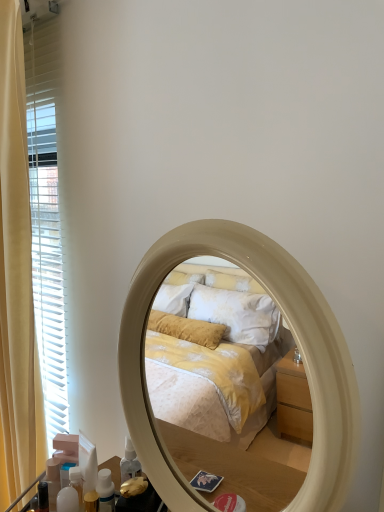
Question: Is beige glossy mirror at center wider than translucent plastic bottle at lower left, placed as the second toiletry when sorted from right to left?

Choices:
 (A) yes
 (B) no

Answer: (A)

Question: From the image's perspective, does beige glossy mirror at center appear lower than translucent plastic bottle at lower left, arranged as the 2th toiletry when viewed from the front?

Choices:
 (A) yes
 (B) no

Answer: (B)

Question: Is beige glossy mirror at center directly adjacent to translucent plastic bottle at lower left, the first toiletry positioned from the back?

Choices:
 (A) no
 (B) yes

Answer: (A)

Question: Considering the relative sizes of beige glossy mirror at center and translucent plastic bottle at lower left, placed as the second toiletry when sorted from right to left, in the image provided, is beige glossy mirror at center thinner than translucent plastic bottle at lower left, placed as the second toiletry when sorted from right to left,?

Choices:
 (A) yes
 (B) no

Answer: (B)

Question: Considering the relative positions of beige glossy mirror at center and translucent plastic bottle at lower left, placed as the second toiletry when sorted from right to left, in the image provided, is beige glossy mirror at center behind translucent plastic bottle at lower left, placed as the second toiletry when sorted from right to left,?

Choices:
 (A) yes
 (B) no

Answer: (B)

Question: Does beige glossy mirror at center have a lesser height compared to translucent plastic bottle at lower left, the first toiletry positioned from the back?

Choices:
 (A) yes
 (B) no

Answer: (B)

Question: Is beige glossy mirror at center surrounded by translucent plastic bottle at lower left, placed as the second toiletry when sorted from right to left?

Choices:
 (A) yes
 (B) no

Answer: (B)

Question: Does translucent plastic bottle at lower left, the first toiletry positioned from the back, appear on the left side of beige glossy mirror at center?

Choices:
 (A) yes
 (B) no

Answer: (A)

Question: Is translucent plastic bottle at lower left, the first toiletry viewed from the left, thinner than beige glossy mirror at center?

Choices:
 (A) no
 (B) yes

Answer: (B)

Question: From a real-world perspective, is translucent plastic bottle at lower left, the first toiletry viewed from the left, on beige glossy mirror at center?

Choices:
 (A) no
 (B) yes

Answer: (A)

Question: Are translucent plastic bottle at lower left, arranged as the 2th toiletry when viewed from the front, and beige glossy mirror at center far apart?

Choices:
 (A) no
 (B) yes

Answer: (A)

Question: From a real-world perspective, is translucent plastic bottle at lower left, the first toiletry positioned from the back, physically below beige glossy mirror at center?

Choices:
 (A) no
 (B) yes

Answer: (B)

Question: Is beige glossy mirror at center taller than translucent plastic bottles at lower left, the 2th toiletry viewed from the left?

Choices:
 (A) yes
 (B) no

Answer: (A)